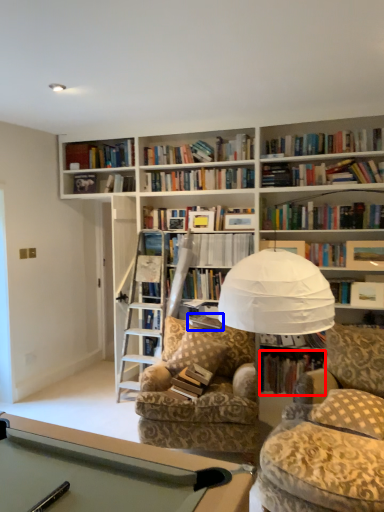
Question: Among these objects, which one is nearest to the camera, book (highlighted by a red box) or paperback book (highlighted by a blue box)?

Choices:
 (A) book
 (B) paperback book

Answer: (B)